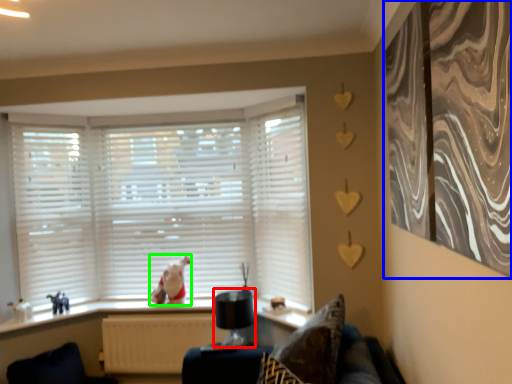
Question: Which is nearer to the lamp (highlighted by a red box)? curtain (highlighted by a blue box) or animal (highlighted by a green box).

Choices:
 (A) curtain
 (B) animal

Answer: (B)